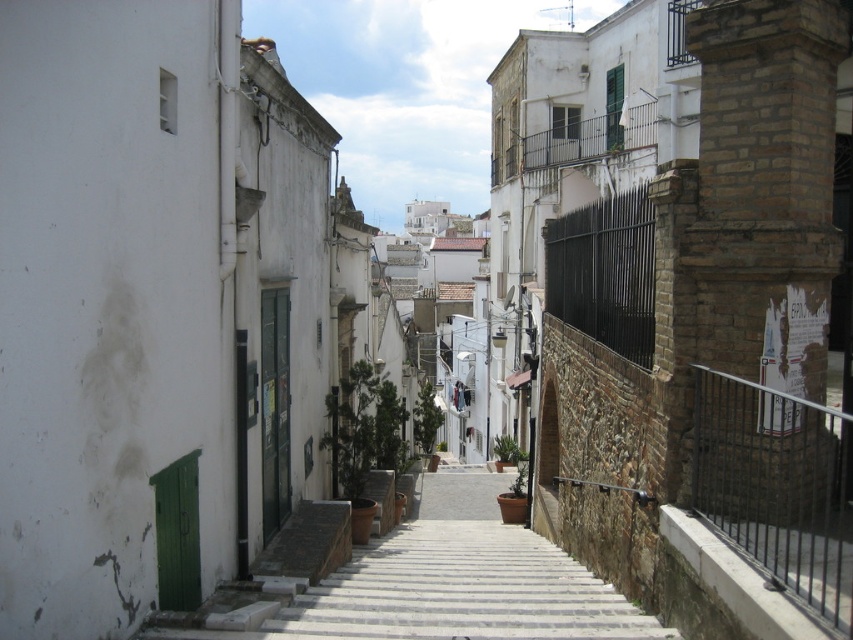
Question: Can you confirm if white concrete stairs at center is positioned to the right of black metal fence at right?

Choices:
 (A) yes
 (B) no

Answer: (B)

Question: Which point is closer to the camera?

Choices:
 (A) (727, 452)
 (B) (323, 602)

Answer: (A)

Question: Is white concrete stairs at center positioned before black metal fence at right?

Choices:
 (A) no
 (B) yes

Answer: (A)

Question: Is white concrete stairs at center bigger than black metal fence at right?

Choices:
 (A) no
 (B) yes

Answer: (B)

Question: Which point appears farthest from the camera in this image?

Choices:
 (A) (334, 600)
 (B) (770, 548)

Answer: (A)